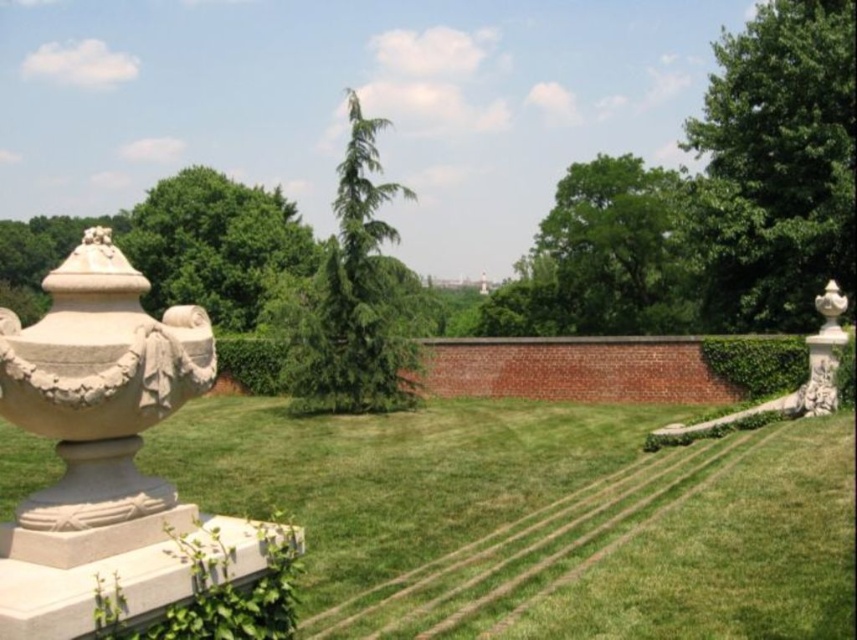
Which of these two, green leafy tree at center or green needle-like tree at center, stands taller?

With more height is green needle-like tree at center.

Which is behind, point (742, 220) or point (351, 404)?

Positioned behind is point (742, 220).

I want to click on green leafy tree at center, so click(x=774, y=168).

Can you confirm if green needle-like tree at center is bigger than white stone vase at right?

Indeed, green needle-like tree at center has a larger size compared to white stone vase at right.

Looking at this image, who is positioned more to the left, green needle-like tree at center or white stone vase at right?

From the viewer's perspective, green needle-like tree at center appears more on the left side.

Does point (384, 273) come behind point (832, 308)?

Yes, point (384, 273) is farther from viewer.

Locate an element on the screen. green needle-like tree at center is located at coordinates (357, 296).

Who is more distant from viewer, (x=106, y=387) or (x=388, y=387)?

The point (x=388, y=387) is more distant.

Does point (93, 356) lie in front of point (345, 371)?

Yes, point (93, 356) is in front of point (345, 371).

Where is `white stone urn at left`? white stone urn at left is located at coordinates (99, 404).